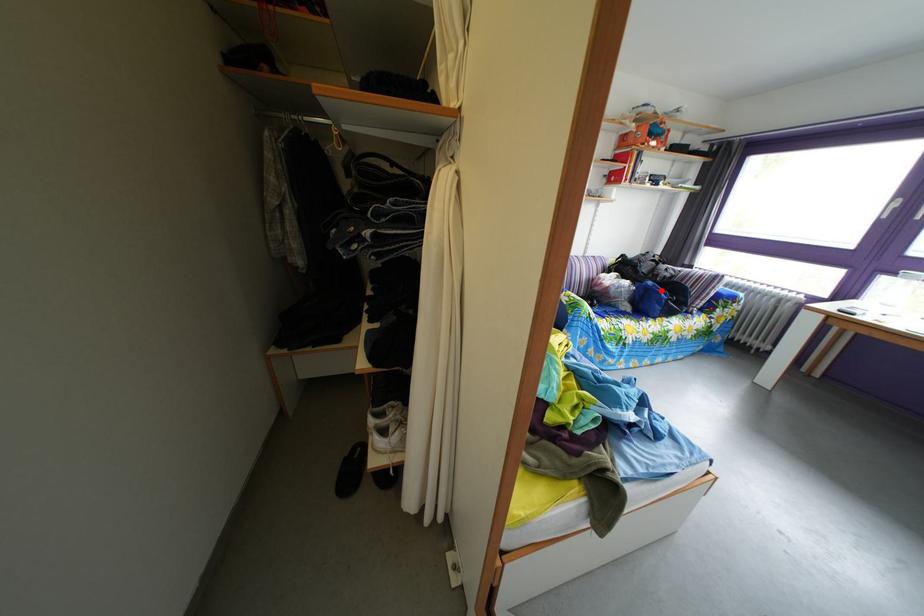
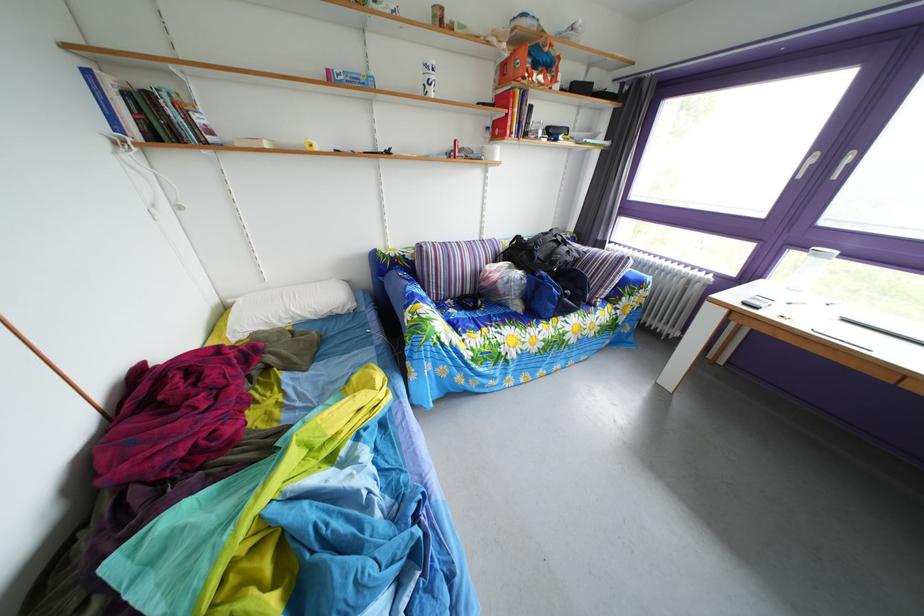
The point at the highlighted location is marked in the first image. Where is the corresponding point in the second image?

(553, 282)